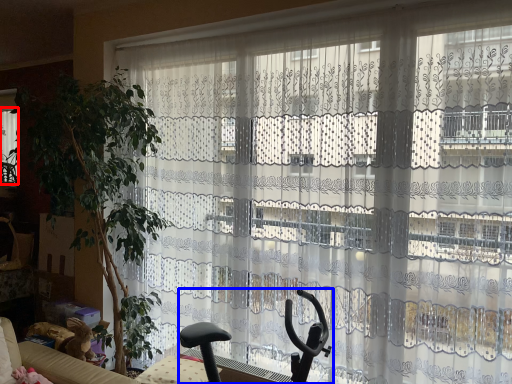
Question: Which object is further to the camera taking this photo, window (highlighted by a red box) or swivel chair (highlighted by a blue box)?

Choices:
 (A) window
 (B) swivel chair

Answer: (A)